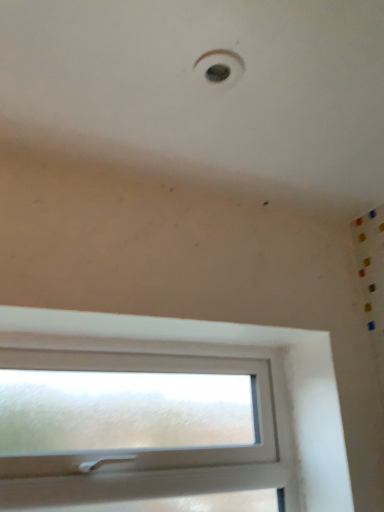
This screenshot has width=384, height=512. What do you see at coordinates (220, 67) in the screenshot?
I see `matte plastic hole at upper center` at bounding box center [220, 67].

What is the approximate width of matte plastic hole at upper center?

The width of matte plastic hole at upper center is 3.55 inches.

Identify the location of matte plastic hole at upper center. The image size is (384, 512). (220, 67).

Where is `matte plastic hole at upper center`? The width and height of the screenshot is (384, 512). matte plastic hole at upper center is located at coordinates (220, 67).